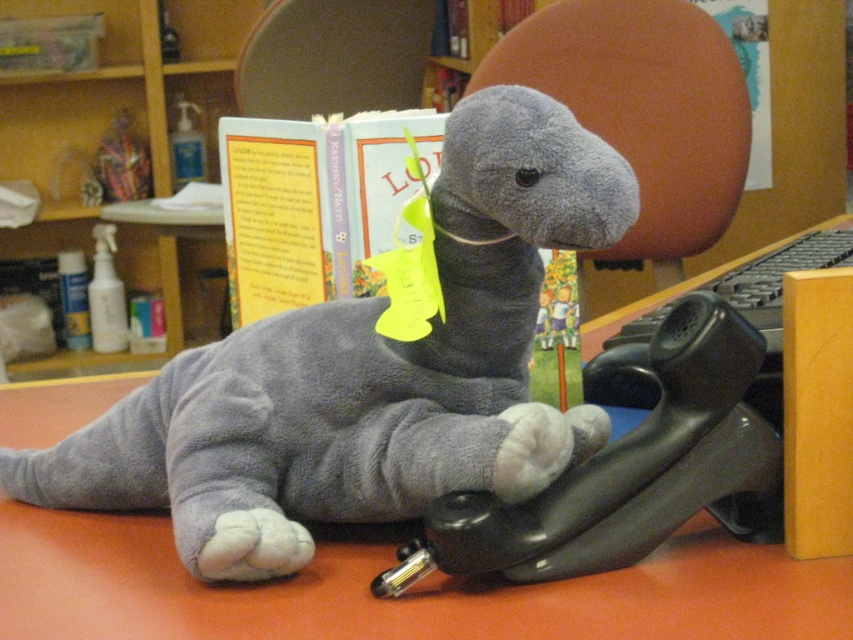
Can you confirm if gray plush dinosaur at center is thinner than light blue paper book at center?

No.

Is gray plush dinosaur at center to the left of light blue paper book at center from the viewer's perspective?

No, gray plush dinosaur at center is not to the left of light blue paper book at center.

The width and height of the screenshot is (853, 640). Find the location of `gray plush dinosaur at center`. gray plush dinosaur at center is located at coordinates (366, 372).

Which of these two, black rubber telephone at lower center or light blue paper book at center, stands shorter?

With less height is black rubber telephone at lower center.

Is point (689, 474) in front of point (265, 246)?

That is True.

Measure the distance between point (688,324) and camera.

Point (688,324) and camera are 19.57 inches apart.

Find the location of a particular element. This screenshot has height=640, width=853. black rubber telephone at lower center is located at coordinates pos(628,467).

Find the location of `gray plush dinosaur at center`. gray plush dinosaur at center is located at coordinates (366, 372).

Where is `gray plush dinosaur at center`? gray plush dinosaur at center is located at coordinates (366, 372).